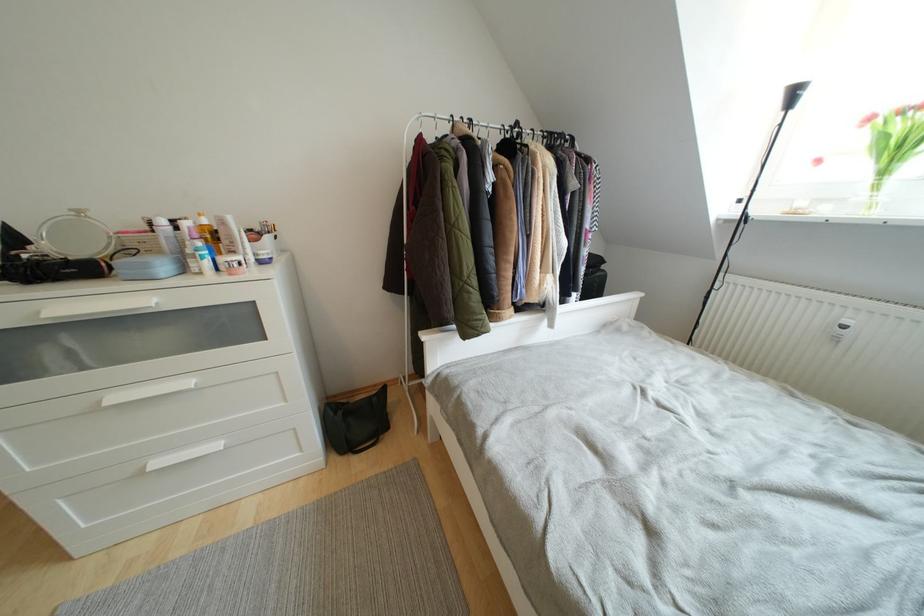
Image resolution: width=924 pixels, height=616 pixels. I want to click on radiator control dial, so click(x=841, y=330).